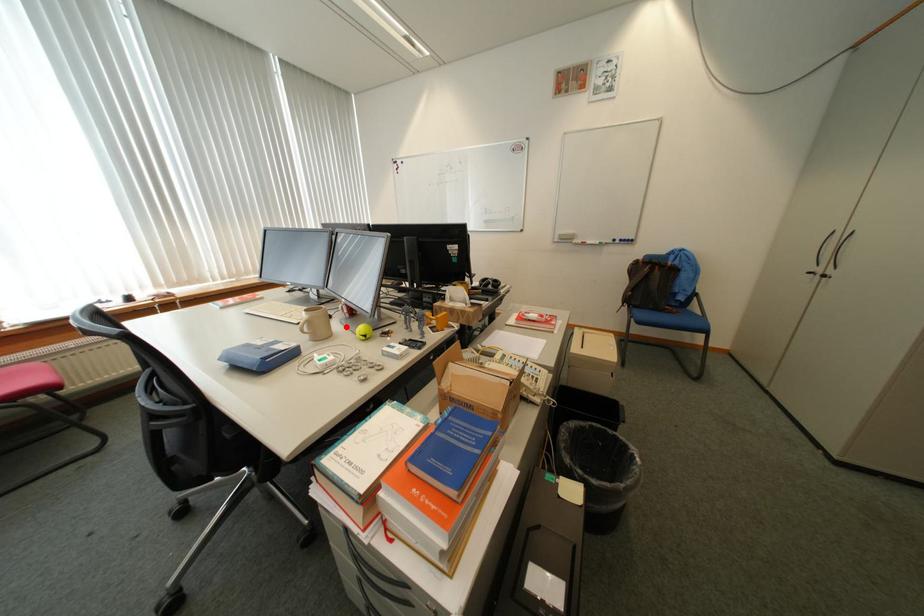
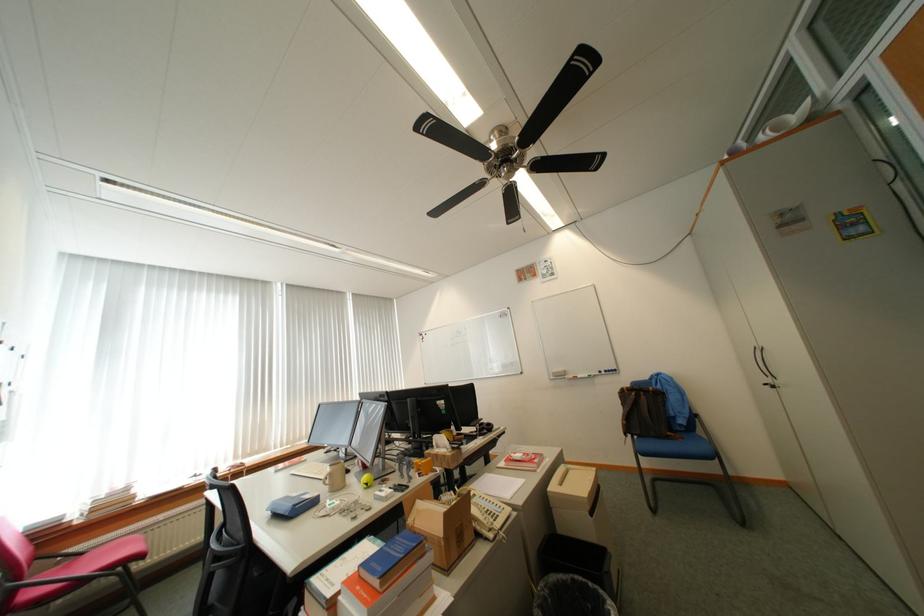
The point at the highlighted location is marked in the first image. Where is the corresponding point in the second image?

(360, 479)